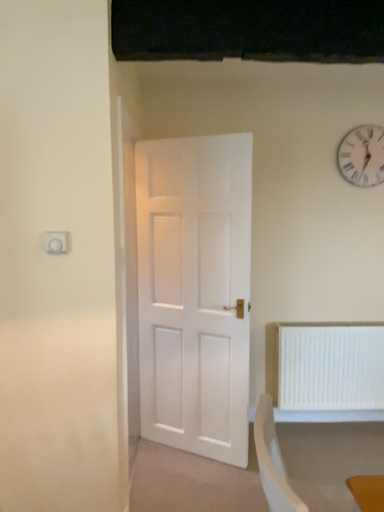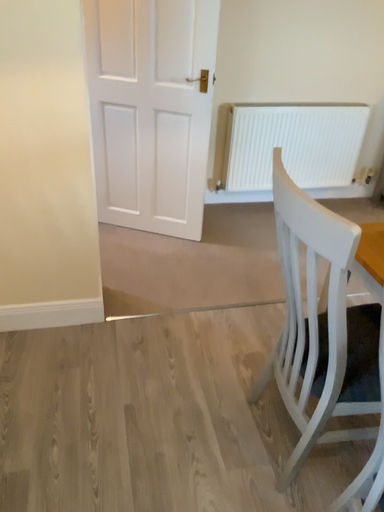
Question: How did the camera likely rotate when shooting the video?

Choices:
 (A) rotated upward
 (B) rotated downward

Answer: (B)